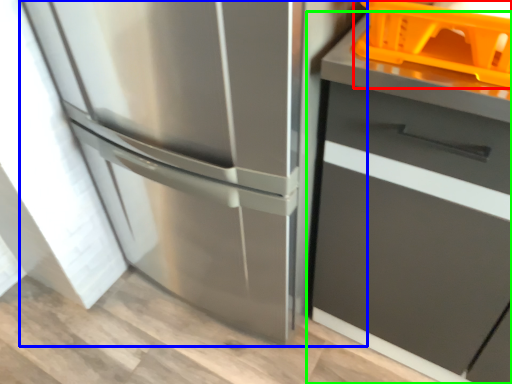
Question: Which object is positioned farthest from basket (highlighted by a red box)? Select from refrigerator (highlighted by a blue box) and cabinetry (highlighted by a green box).

Choices:
 (A) refrigerator
 (B) cabinetry

Answer: (A)